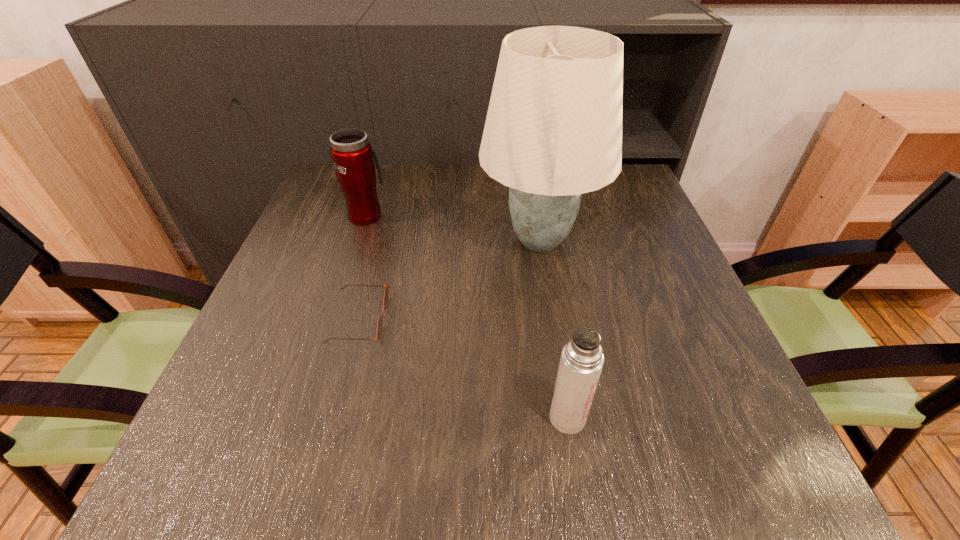
Identify the location of lampshade. The image size is (960, 540). (553, 131).

Where is `the farther thermos bottle`? the farther thermos bottle is located at coordinates (352, 154).

Where is `the right thermos bottle`? The width and height of the screenshot is (960, 540). the right thermos bottle is located at coordinates (581, 362).

The width and height of the screenshot is (960, 540). Identify the location of the nearest object. (581, 362).

Locate an element on the screen. Image resolution: width=960 pixels, height=540 pixels. sunglasses is located at coordinates (386, 294).

What are the coordinates of `the shortest object` in the screenshot? It's located at (386, 294).

Where is `free space located on the back of the tallest object`? The width and height of the screenshot is (960, 540). free space located on the back of the tallest object is located at coordinates (530, 178).

Where is `free space located on the side with the handle of the farther thermos bottle`? Image resolution: width=960 pixels, height=540 pixels. free space located on the side with the handle of the farther thermos bottle is located at coordinates (374, 193).

Locate an element on the screen. The image size is (960, 540). vacant space situated on the side with the handle of the farther thermos bottle is located at coordinates (376, 187).

Locate an element on the screen. This screenshot has width=960, height=540. free space located on the side with the handle of the farther thermos bottle is located at coordinates (381, 172).